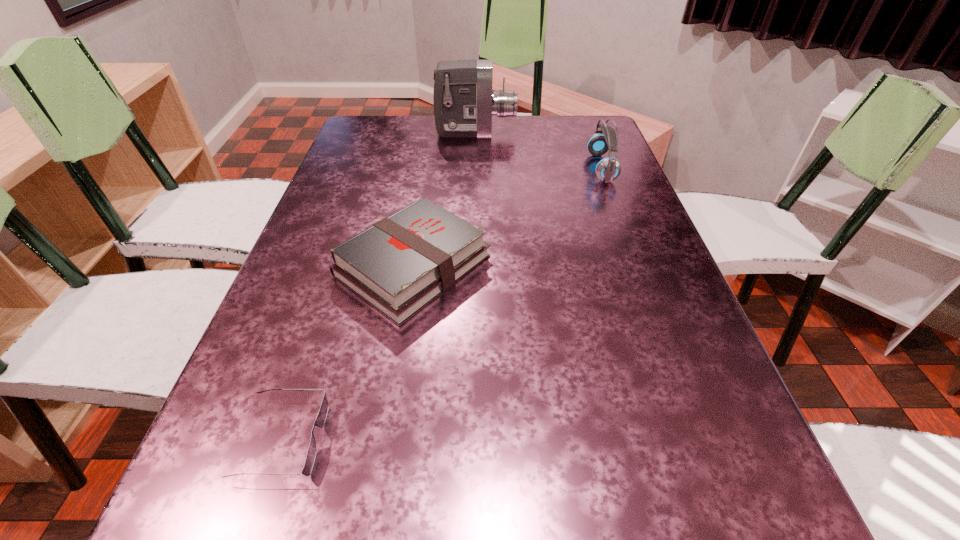
The height and width of the screenshot is (540, 960). I want to click on vacant area between the tallest object and the headset, so click(x=539, y=150).

Where is `free spot between the rightmost object and the hardback book`? The height and width of the screenshot is (540, 960). free spot between the rightmost object and the hardback book is located at coordinates click(507, 217).

You are a GUI agent. You are given a task and a screenshot of the screen. Output one action in this format:
    pyautogui.click(x=<x>, y=<y>)
    Task: Click on the free space between the sunglasses and the headset
    The image size is (960, 540).
    Given the screenshot: What is the action you would take?
    pyautogui.click(x=442, y=303)

The image size is (960, 540). Identify the location of object that can be found as the second closest to the second shortest object. (608, 169).

Find the location of a particular element. Image resolution: width=960 pixels, height=540 pixels. object that stands as the second closest to the farthest object is located at coordinates (400, 264).

The image size is (960, 540). What are the coordinates of `vacant space that satisfies the following two spatial constraints: 1. on the ear cups of the headset; 2. on the front side of the second shortest object` in the screenshot? It's located at (638, 266).